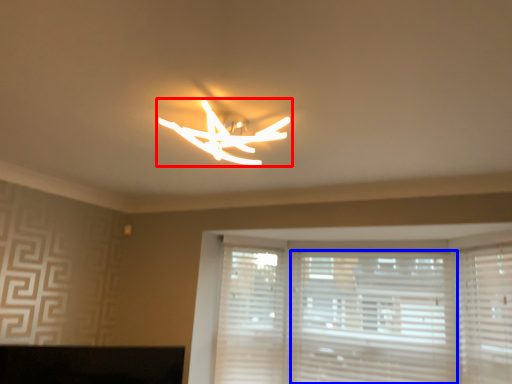
Question: Which point is closer to the camera, lamp (highlighted by a red box) or blind (highlighted by a blue box)?

Choices:
 (A) lamp
 (B) blind

Answer: (A)